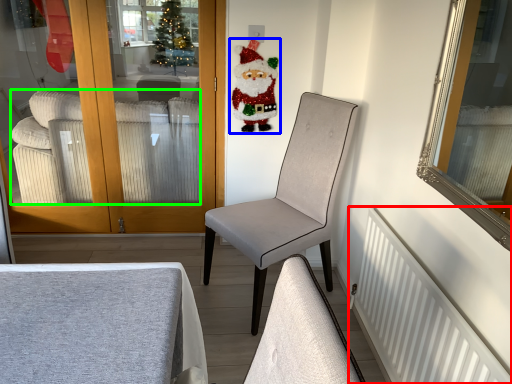
Question: Which object is the farthest from radiator (highlighted by a red box)? Choose among these: santa claus (highlighted by a blue box) or studio couch (highlighted by a green box).

Choices:
 (A) santa claus
 (B) studio couch

Answer: (B)